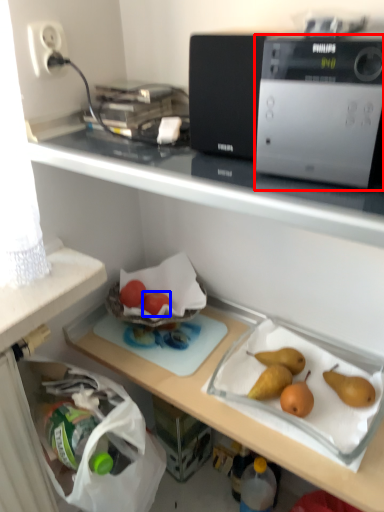
Question: Among these objects, which one is farthest to the camera, home appliance (highlighted by a red box) or fruit (highlighted by a blue box)?

Choices:
 (A) home appliance
 (B) fruit

Answer: (B)